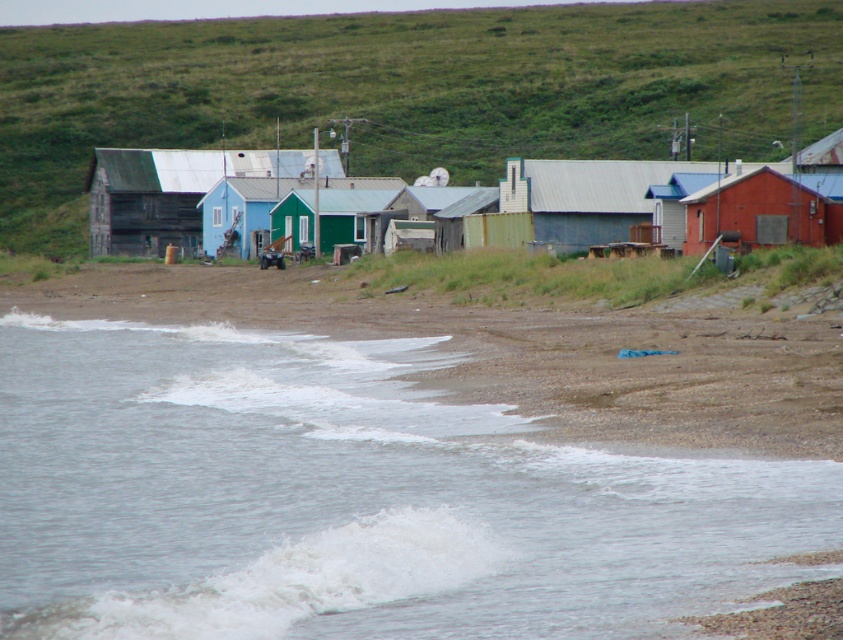
Question: Which point is closer to the camera taking this photo?

Choices:
 (A) (207, 355)
 (B) (790, 195)
 (C) (234, 195)

Answer: (A)

Question: Is clear water at lower left thinner than wooden cabin at center?

Choices:
 (A) yes
 (B) no

Answer: (A)

Question: Is the position of clear water at lower left more distant than that of rustic wooden shack at right?

Choices:
 (A) yes
 (B) no

Answer: (B)

Question: Does clear water at lower left have a smaller size compared to green grassy hillside at upper center?

Choices:
 (A) yes
 (B) no

Answer: (A)

Question: Among these objects, which one is farthest from the camera?

Choices:
 (A) metallic gray hut at center-right
 (B) green grassy hillside at upper center
 (C) rustic wooden shack at right
 (D) wooden cabin at center

Answer: (B)

Question: Estimate the real-world distances between objects in this image. Which object is closer to the wooden cabin at center?

Choices:
 (A) blue wooden house at center
 (B) clear water at lower left
 (C) metallic gray hut at center-right
 (D) rustic wooden shack at right

Answer: (A)